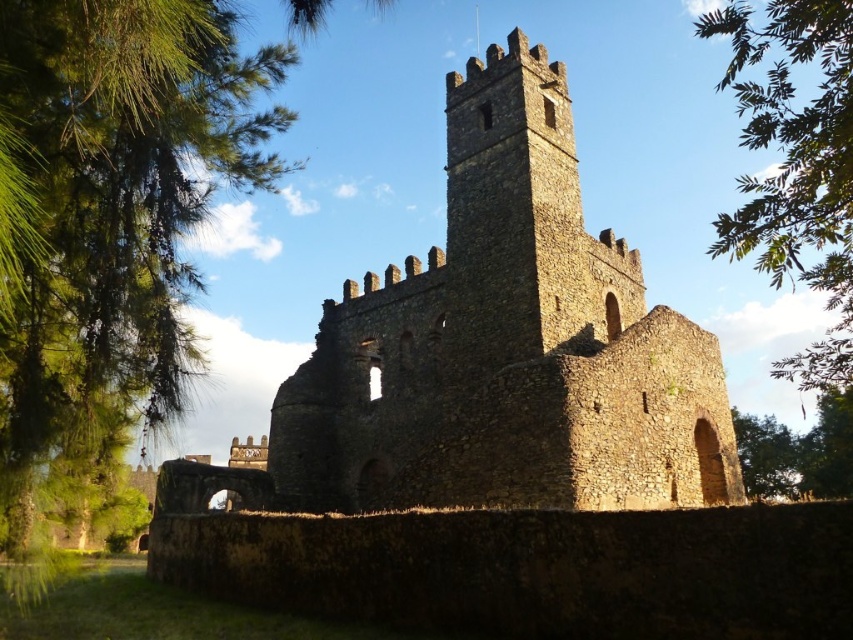
Question: Does brown stone tower at center have a larger size compared to green leafy tree at upper left?

Choices:
 (A) no
 (B) yes

Answer: (B)

Question: Does green leafy tree at upper left appear over green leafy tree at lower right?

Choices:
 (A) yes
 (B) no

Answer: (A)

Question: Among these points, which one is nearest to the camera?

Choices:
 (A) (817, 109)
 (B) (740, 456)
 (C) (442, 440)

Answer: (A)

Question: Which point is farther to the camera?

Choices:
 (A) (479, 77)
 (B) (791, 456)

Answer: (B)

Question: Among these objects, which one is farthest from the camera?

Choices:
 (A) green leafy tree at upper left
 (B) green leafy tree at lower right
 (C) brown stone tower at center

Answer: (B)

Question: Can you confirm if brown stone tower at center is thinner than green leafy tree at upper right?

Choices:
 (A) no
 (B) yes

Answer: (B)